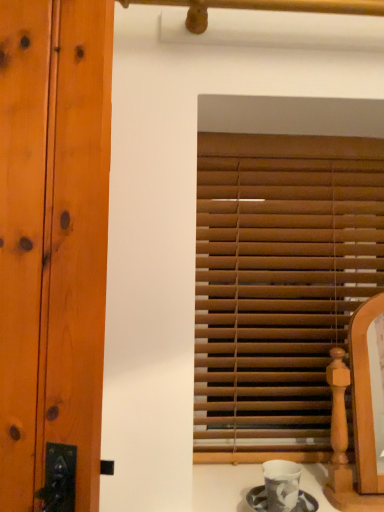
Question: Is porcelain cup at lower center located outside wooden blinds at center?

Choices:
 (A) yes
 (B) no

Answer: (A)

Question: From a real-world perspective, is porcelain cup at lower center physically below wooden blinds at center?

Choices:
 (A) no
 (B) yes

Answer: (B)

Question: Considering the relative sizes of porcelain cup at lower center and wooden blinds at center in the image provided, is porcelain cup at lower center bigger than wooden blinds at center?

Choices:
 (A) yes
 (B) no

Answer: (B)

Question: Could you tell me if porcelain cup at lower center is turned towards wooden blinds at center?

Choices:
 (A) yes
 (B) no

Answer: (B)

Question: Does porcelain cup at lower center have a greater width compared to wooden blinds at center?

Choices:
 (A) yes
 (B) no

Answer: (A)

Question: Does porcelain cup at lower center have a greater height compared to wooden blinds at center?

Choices:
 (A) yes
 (B) no

Answer: (B)

Question: From a real-world perspective, is wooden blinds at center positioned under porcelain cup at lower center based on gravity?

Choices:
 (A) yes
 (B) no

Answer: (B)

Question: Considering the relative sizes of wooden blinds at center and porcelain cup at lower center in the image provided, is wooden blinds at center bigger than porcelain cup at lower center?

Choices:
 (A) no
 (B) yes

Answer: (B)

Question: Does wooden blinds at center have a smaller size compared to porcelain cup at lower center?

Choices:
 (A) no
 (B) yes

Answer: (A)

Question: Can you confirm if wooden blinds at center is shorter than porcelain cup at lower center?

Choices:
 (A) yes
 (B) no

Answer: (B)

Question: Is wooden blinds at center in front of porcelain cup at lower center?

Choices:
 (A) yes
 (B) no

Answer: (B)

Question: From the image's perspective, is wooden blinds at center located above porcelain cup at lower center?

Choices:
 (A) yes
 (B) no

Answer: (A)

Question: From the image's perspective, is wooden blinds at center positioned above or below porcelain cup at lower center?

Choices:
 (A) above
 (B) below

Answer: (A)